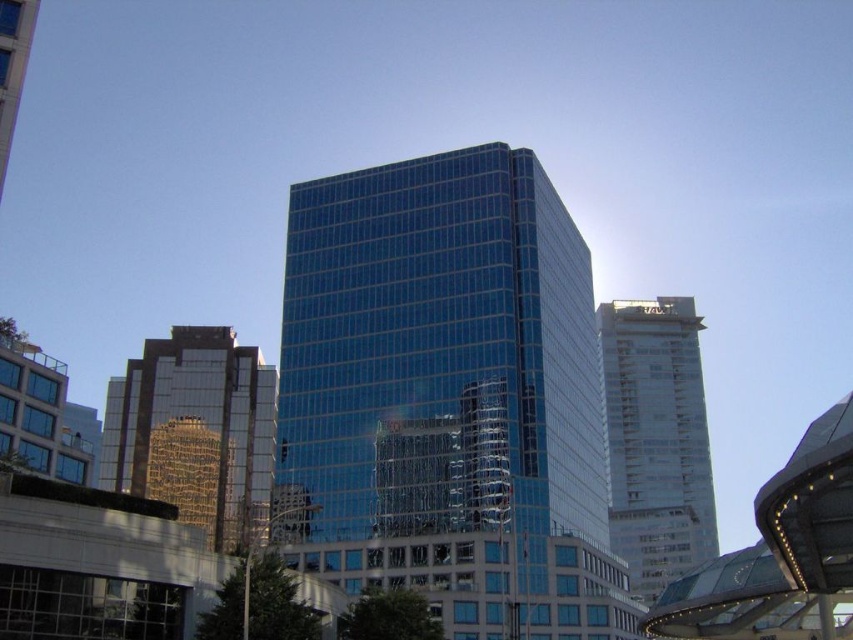
Question: Is glassy blue skyscraper at center below reflective glass building at left?

Choices:
 (A) yes
 (B) no

Answer: (B)

Question: Which of the following is the closest to the observer?

Choices:
 (A) (334, 396)
 (B) (180, 467)
 (C) (645, 588)

Answer: (A)

Question: Is glassy blue skyscraper at center positioned at the back of white glass tower at right?

Choices:
 (A) no
 (B) yes

Answer: (A)

Question: Does glassy blue skyscraper at center appear on the right side of white glass tower at right?

Choices:
 (A) no
 (B) yes

Answer: (A)

Question: Which of the following is the closest to the observer?

Choices:
 (A) (537, 625)
 (B) (668, 524)

Answer: (A)

Question: Which point is closer to the camera taking this photo?

Choices:
 (A) (350, 214)
 (B) (207, 406)
 (C) (619, 321)

Answer: (A)